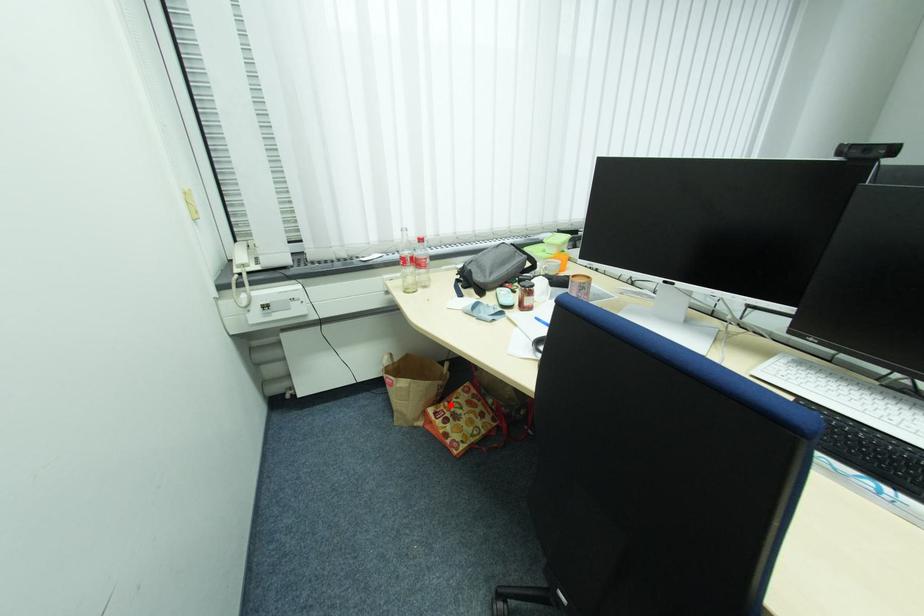
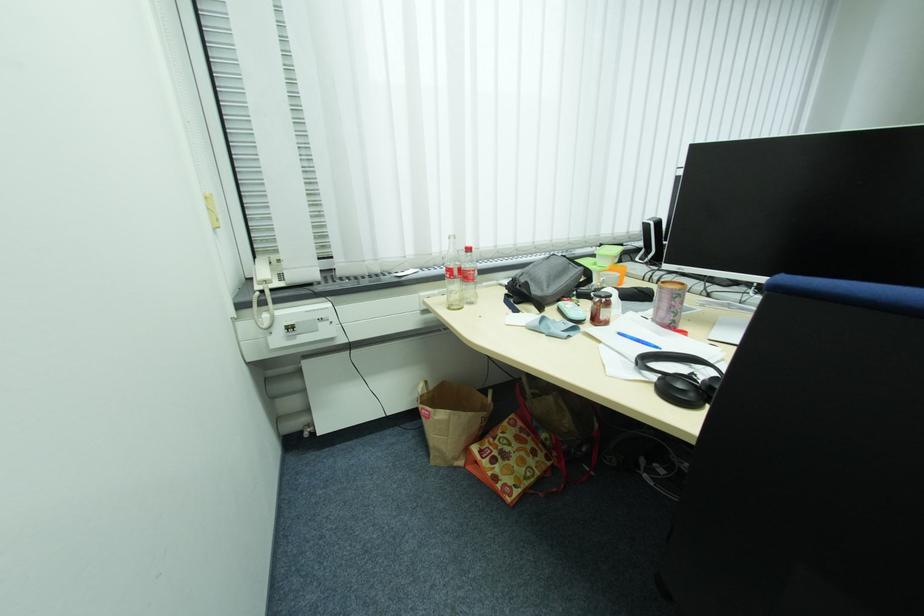
In the second image, find the point that corresponds to the highlighted location in the first image.

(495, 442)